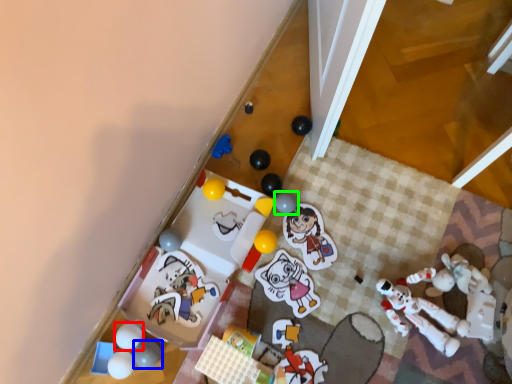
Question: Which object is positioned closest to toy (highlighted by a red box)? Select from toy (highlighted by a blue box) and toy (highlighted by a green box).

Choices:
 (A) toy
 (B) toy

Answer: (A)